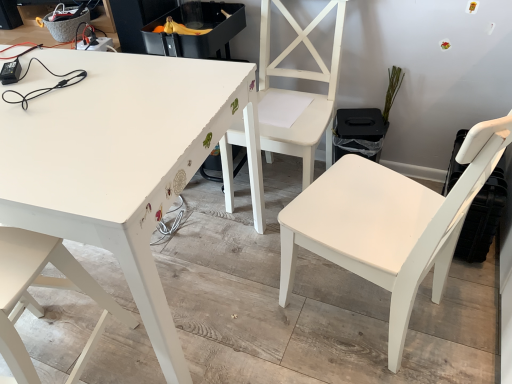
Question: Considering the relative sizes of white matte chair at center, the 2th chair viewed from the right, and white matte chair at center, arranged as the 3th chair when viewed from the left, in the image provided, is white matte chair at center, the 2th chair viewed from the right, bigger than white matte chair at center, arranged as the 3th chair when viewed from the left,?

Choices:
 (A) no
 (B) yes

Answer: (A)

Question: Is white matte chair at center, which is the 2th chair in left-to-right order, not within white matte chair at center, arranged as the 3th chair when viewed from the left?

Choices:
 (A) no
 (B) yes

Answer: (B)

Question: Can you confirm if white matte chair at center, the 2th chair viewed from the right, is taller than white matte chair at center, arranged as the 3th chair when viewed from the left?

Choices:
 (A) no
 (B) yes

Answer: (B)

Question: From a real-world perspective, does white matte chair at center, which is the 2th chair in left-to-right order, stand above white matte chair at center, arranged as the 3th chair when viewed from the left?

Choices:
 (A) yes
 (B) no

Answer: (B)

Question: Considering the relative positions of white matte chair at center, the 2th chair viewed from the right, and white matte chair at center, arranged as the 3th chair when viewed from the left, in the image provided, is white matte chair at center, the 2th chair viewed from the right, to the left of white matte chair at center, arranged as the 3th chair when viewed from the left, from the viewer's perspective?

Choices:
 (A) no
 (B) yes

Answer: (B)

Question: Does point (257, 195) appear closer or farther from the camera than point (219, 99)?

Choices:
 (A) farther
 (B) closer

Answer: (A)

Question: Is white matte chair at center, which is the 2th chair in left-to-right order, taller or shorter than white painted wood table at upper left?

Choices:
 (A) short
 (B) tall

Answer: (B)

Question: In the image, is white matte chair at center, the 2th chair viewed from the right, positioned in front of or behind white painted wood table at upper left?

Choices:
 (A) behind
 (B) front

Answer: (A)

Question: From the image's perspective, is white matte chair at center, which is the 2th chair in left-to-right order, above or below white painted wood table at upper left?

Choices:
 (A) above
 (B) below

Answer: (A)

Question: Is white matte chair at lower left, which appears as the 3th chair when viewed from the right, taller or shorter than white matte chair at center, the first chair positioned from the right?

Choices:
 (A) short
 (B) tall

Answer: (A)

Question: From the image's perspective, relative to white matte chair at center, the first chair positioned from the right, is white matte chair at lower left, which is counted as the first chair, starting from the left, above or below?

Choices:
 (A) above
 (B) below

Answer: (B)

Question: In the image, is white matte chair at lower left, which appears as the 3th chair when viewed from the right, on the left side or the right side of white matte chair at center, the first chair positioned from the right?

Choices:
 (A) left
 (B) right

Answer: (A)

Question: Is white matte chair at lower left, which is counted as the first chair, starting from the left, in front of or behind white matte chair at center, arranged as the 3th chair when viewed from the left, in the image?

Choices:
 (A) front
 (B) behind

Answer: (B)

Question: Considering the positions of white painted wood table at upper left and white matte chair at center, the first chair positioned from the right, in the image, is white painted wood table at upper left wider or thinner than white matte chair at center, the first chair positioned from the right,?

Choices:
 (A) thin
 (B) wide

Answer: (B)

Question: From a real-world perspective, is white painted wood table at upper left physically located above or below white matte chair at center, the first chair positioned from the right?

Choices:
 (A) below
 (B) above

Answer: (A)